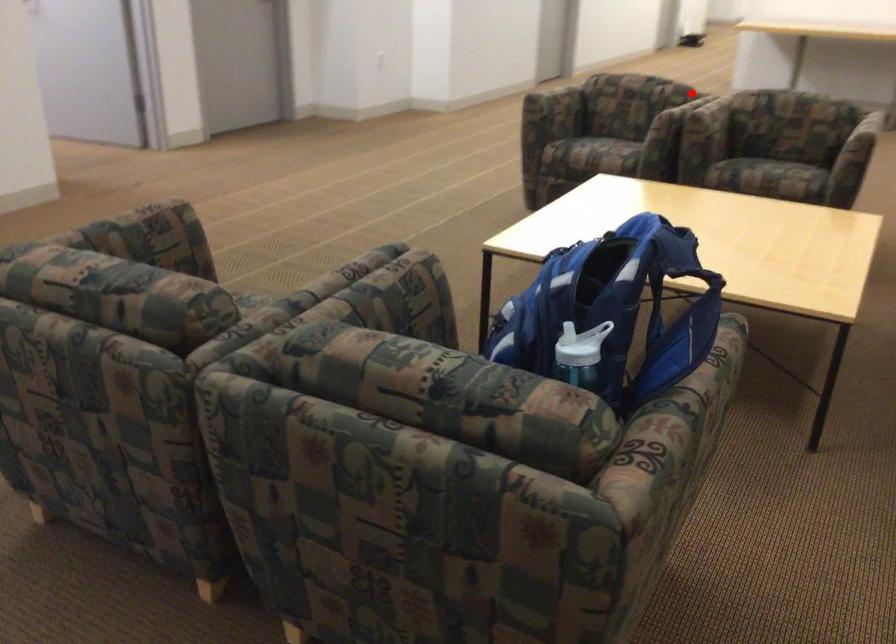
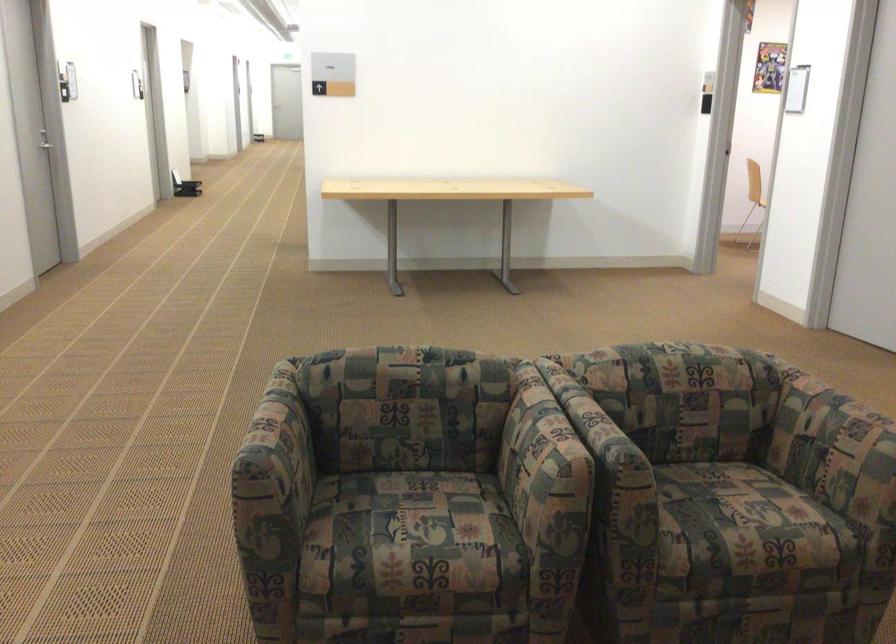
Question: A red point is marked in image1. In image2, is the corresponding 3D point closer to the camera or farther? Reply with the corresponding letter.

Choices:
 (A) The corresponding 3D point is closer.
 (B) The corresponding 3D point is farther.

Answer: (A)